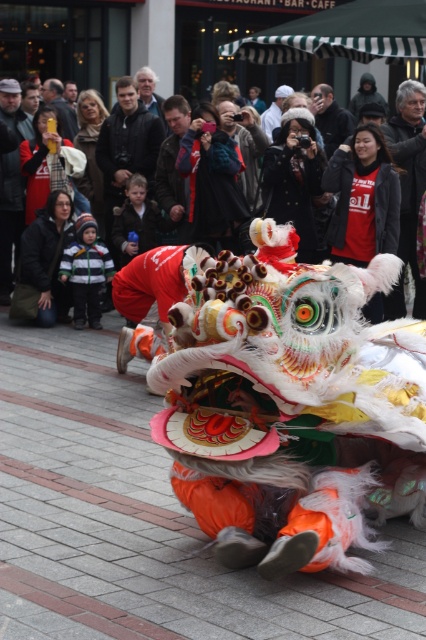
Who is positioned more to the right, dark gray wool coat at upper center or matte black camera at upper center?

dark gray wool coat at upper center is more to the right.

Does dark gray wool coat at upper center appear on the right side of matte black camera at upper center?

Indeed, dark gray wool coat at upper center is positioned on the right side of matte black camera at upper center.

Is point (419, 166) farther from viewer compared to point (333, 122)?

No, (419, 166) is closer to viewer.

You are a GUI agent. You are given a task and a screenshot of the screen. Output one action in this format:
    pyautogui.click(x=<x>, y=<y>)
    Task: Click on the dark gray wool coat at upper center
    
    Given the screenshot: What is the action you would take?
    pyautogui.click(x=409, y=173)

Looking at this image, can you confirm if dark gray hat at center is bigger than matte black jacket at upper left?

Incorrect, dark gray hat at center is not larger than matte black jacket at upper left.

Which is more to the right, dark gray hat at center or matte black jacket at upper left?

Positioned to the right is matte black jacket at upper left.

Describe the element at coordinates (9, 184) in the screenshot. The width and height of the screenshot is (426, 640). I see `dark gray hat at center` at that location.

This screenshot has height=640, width=426. In order to click on dark gray hat at center in this screenshot , I will do `click(9, 184)`.

Who is shorter, matte black jacket at upper center or matte black jacket at upper left?

matte black jacket at upper center

Does point (39, 198) come farther from viewer compared to point (74, 115)?

No, it is not.

Find the location of a particular element. matte black jacket at upper center is located at coordinates (17, 168).